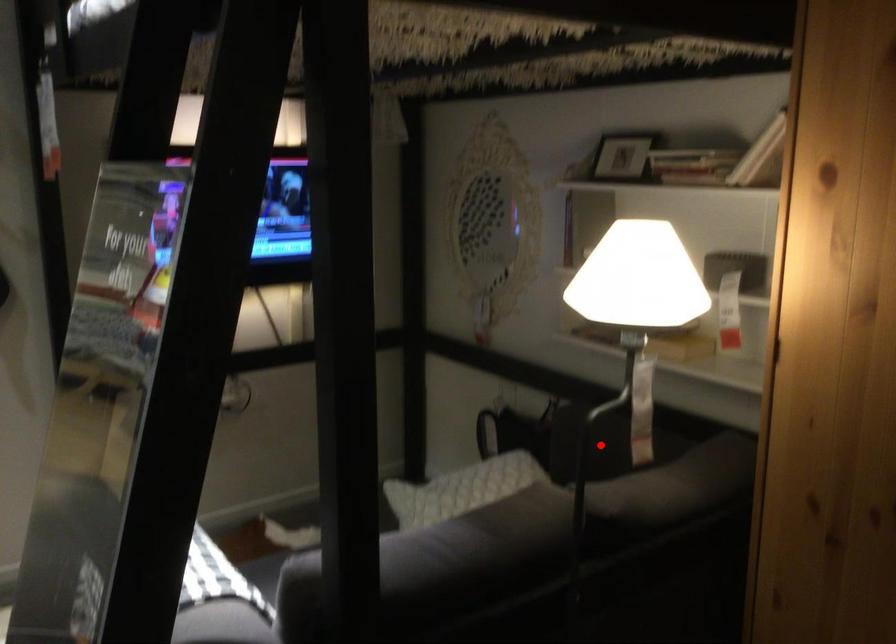
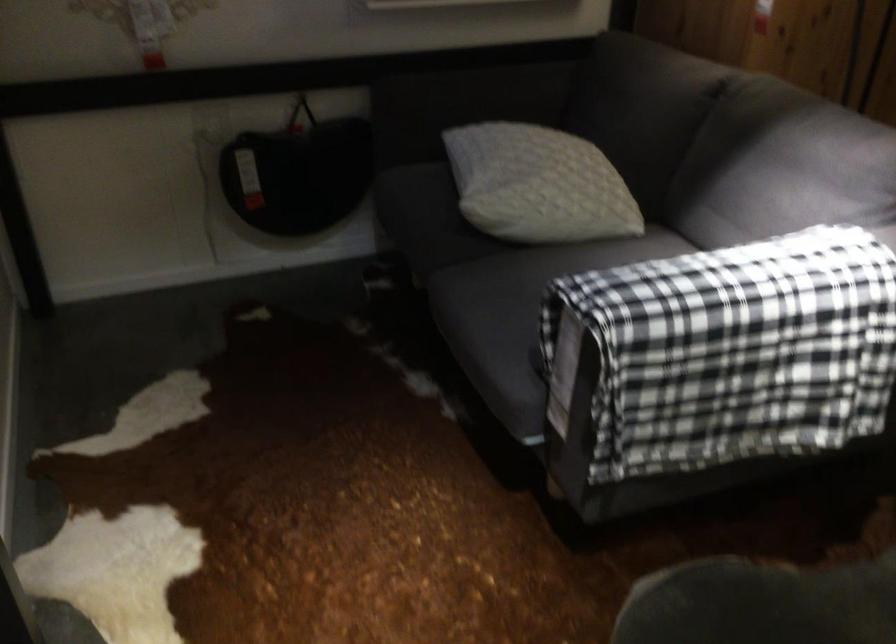
Find the pixel in the second image that matches the highlighted location in the first image.

(478, 98)